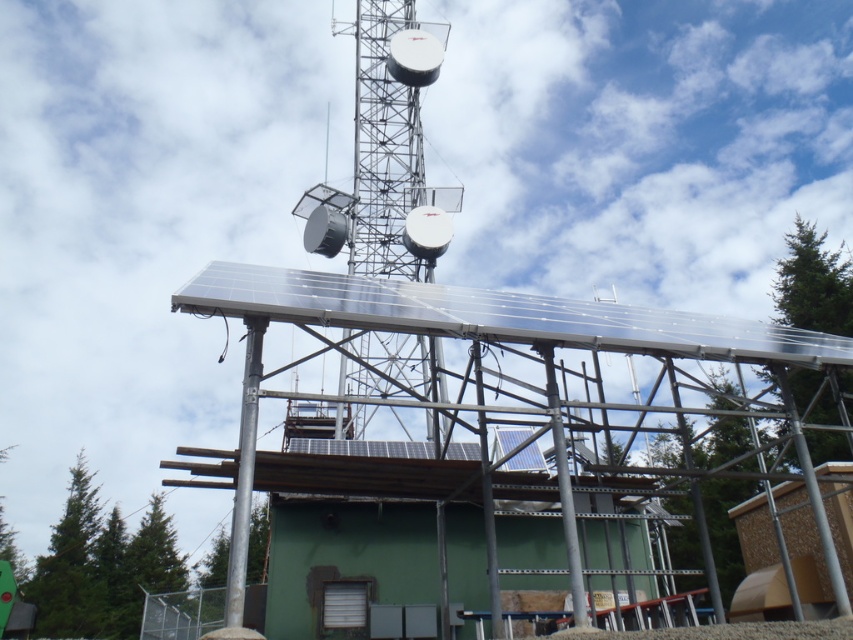
Question: Among these points, which one is nearest to the camera?

Choices:
 (A) (685, 342)
 (B) (254, 634)
 (C) (376, 184)

Answer: (B)

Question: Where is transparent glass solar panel at upper center located in relation to silver metallic pole at center in the image?

Choices:
 (A) above
 (B) below

Answer: (A)

Question: Which point is closer to the camera?

Choices:
 (A) metallic silver tower at center
 (B) silver metallic pole at center
 (C) transparent glass solar panel at upper center

Answer: (B)

Question: Based on their relative distances, which object is nearer to the transparent glass solar panel at upper center?

Choices:
 (A) silver metallic pole at center
 (B) metallic silver tower at center

Answer: (A)

Question: Can you confirm if transparent glass solar panel at upper center is positioned to the right of metallic silver tower at center?

Choices:
 (A) yes
 (B) no

Answer: (A)

Question: Is transparent glass solar panel at upper center positioned before metallic silver tower at center?

Choices:
 (A) yes
 (B) no

Answer: (A)